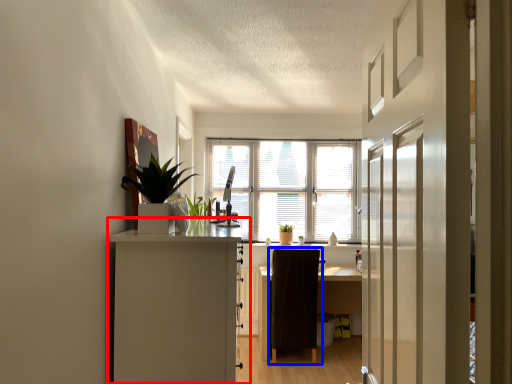
Question: Which object is further to the camera taking this photo, cabinetry (highlighted by a red box) or chair (highlighted by a blue box)?

Choices:
 (A) cabinetry
 (B) chair

Answer: (B)